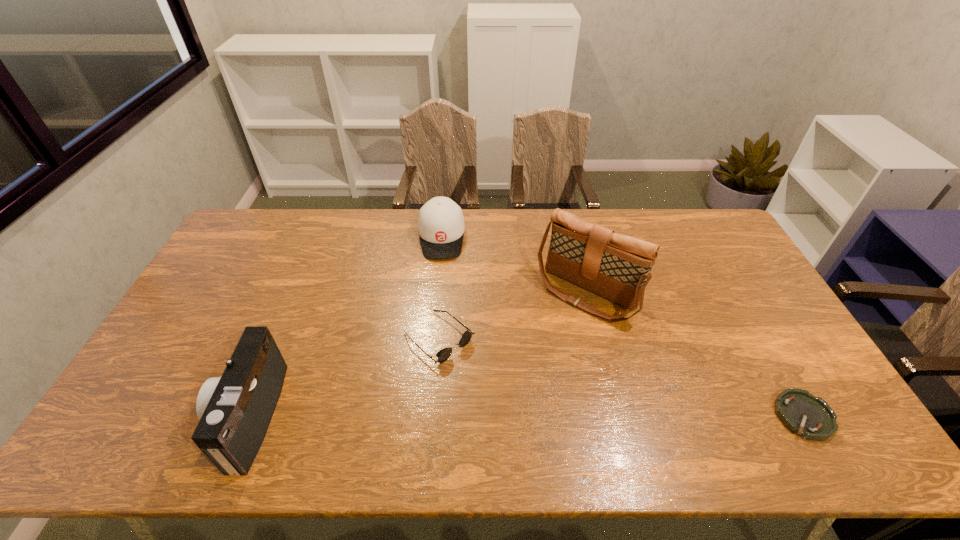
In order to click on vacant space on the desktop that is between the camcorder and the shortest object and is positioned on the front-facing side of the tallest object in this screenshot , I will do `click(491, 416)`.

This screenshot has height=540, width=960. I want to click on free space on the desktop that is between the camcorder and the ashtray and is positioned on the front-facing side of the sunglasses, so click(x=529, y=416).

Where is `free space on the desktop that is between the leftmost object and the shortest object and is positioned on the front-facing side of the baseball cap`? The height and width of the screenshot is (540, 960). free space on the desktop that is between the leftmost object and the shortest object and is positioned on the front-facing side of the baseball cap is located at coordinates (443, 416).